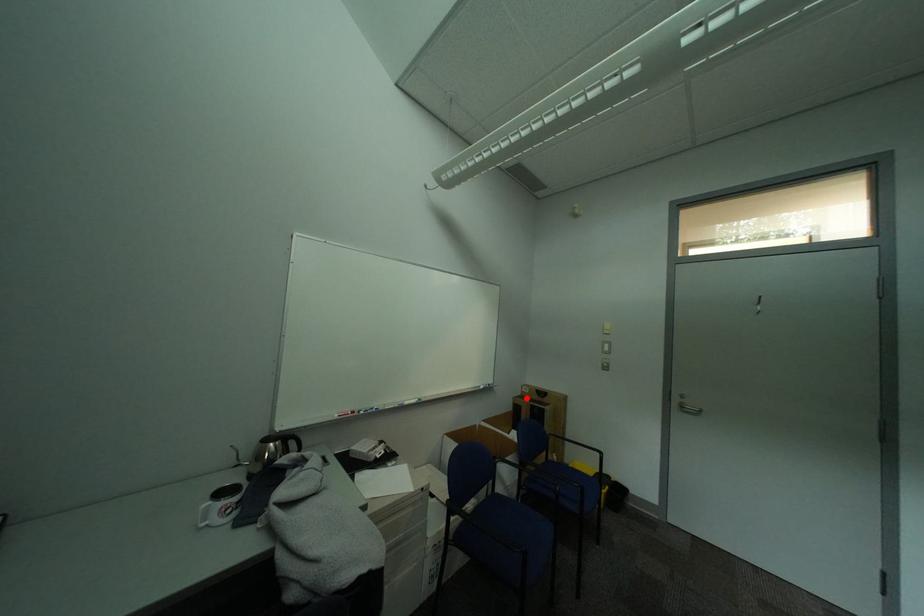
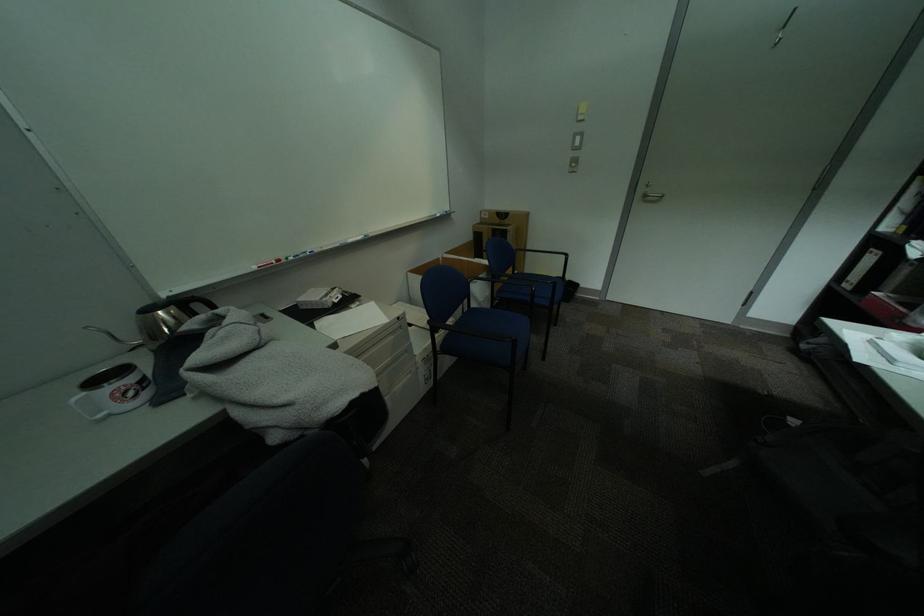
Question: I am providing you with two images of the same scene from different viewpoints. A red point is marked on the first image. Can you still see the location of the red point in image 2?

Choices:
 (A) Yes
 (B) No

Answer: (A)